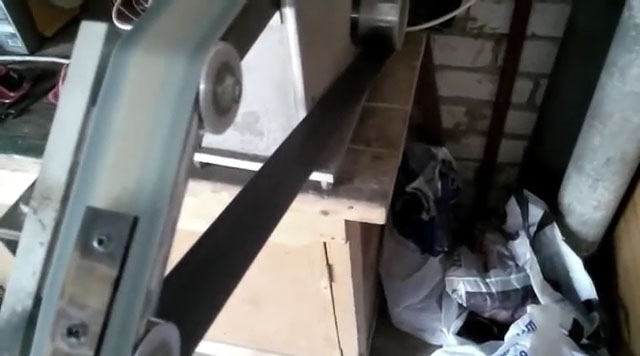
The image size is (640, 356). Identify the location of table top. (370, 169).